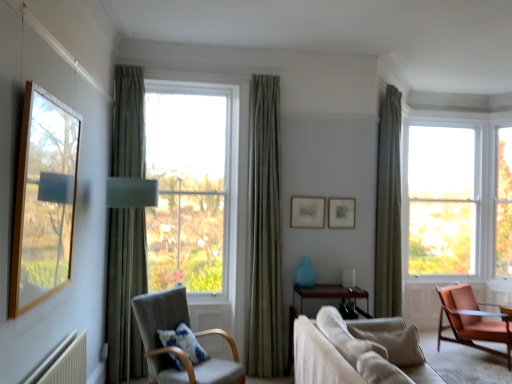
Question: From a real-world perspective, does matte wooden picture frame at center, acting as the second picture frame starting from the right, stand above clear glass window at right, which is counted as the first window, starting from the back?

Choices:
 (A) yes
 (B) no

Answer: (B)

Question: Considering the relative positions of matte wooden picture frame at center, acting as the second picture frame starting from the right, and clear glass window at right, which is counted as the first window, starting from the back, in the image provided, is matte wooden picture frame at center, acting as the second picture frame starting from the right, to the left of clear glass window at right, which is counted as the first window, starting from the back, from the viewer's perspective?

Choices:
 (A) yes
 (B) no

Answer: (A)

Question: Can you confirm if matte wooden picture frame at center, acting as the second picture frame starting from the right, is wider than clear glass window at right, marked as the third window in a front-to-back arrangement?

Choices:
 (A) no
 (B) yes

Answer: (A)

Question: Can you confirm if matte wooden picture frame at center, acting as the second picture frame starting from the right, is positioned to the right of clear glass window at right, acting as the second window starting from the left?

Choices:
 (A) no
 (B) yes

Answer: (A)

Question: Can you confirm if matte wooden picture frame at center, acting as the second picture frame starting from the right, is taller than clear glass window at right, acting as the second window starting from the right?

Choices:
 (A) yes
 (B) no

Answer: (B)

Question: From the image's perspective, does matte wooden picture frame at center, acting as the second picture frame starting from the right, appear higher than clear glass window at right, marked as the third window in a front-to-back arrangement?

Choices:
 (A) yes
 (B) no

Answer: (B)

Question: Is green textured curtain at center, acting as the second curtain starting from the right, touching clear glass window at right, which is counted as the first window, starting from the back?

Choices:
 (A) no
 (B) yes

Answer: (A)

Question: From a real-world perspective, is green textured curtain at center, arranged as the 2th curtain when viewed from the back, physically below clear glass window at right, which is counted as the first window, starting from the back?

Choices:
 (A) no
 (B) yes

Answer: (B)

Question: Is green textured curtain at center, which is the 2th curtain in front-to-back order, positioned far away from clear glass window at right, acting as the second window starting from the right?

Choices:
 (A) yes
 (B) no

Answer: (A)

Question: Is clear glass window at right, which is counted as the first window, starting from the back, surrounded by green textured curtain at center, arranged as the 2th curtain when viewed from the back?

Choices:
 (A) yes
 (B) no

Answer: (B)

Question: Is green textured curtain at center, arranged as the 2th curtain when viewed from the back, to the left of clear glass window at right, marked as the third window in a front-to-back arrangement, from the viewer's perspective?

Choices:
 (A) yes
 (B) no

Answer: (A)

Question: Does green textured curtain at center, the 2th curtain when ordered from left to right, have a greater width compared to clear glass window at right, marked as the third window in a front-to-back arrangement?

Choices:
 (A) yes
 (B) no

Answer: (B)

Question: From a real-world perspective, is green fabric curtain at right, which is the third curtain in left-to-right order, located higher than light gray fabric chair at center-left, which appears as the 1th chair when viewed from the left?

Choices:
 (A) yes
 (B) no

Answer: (A)